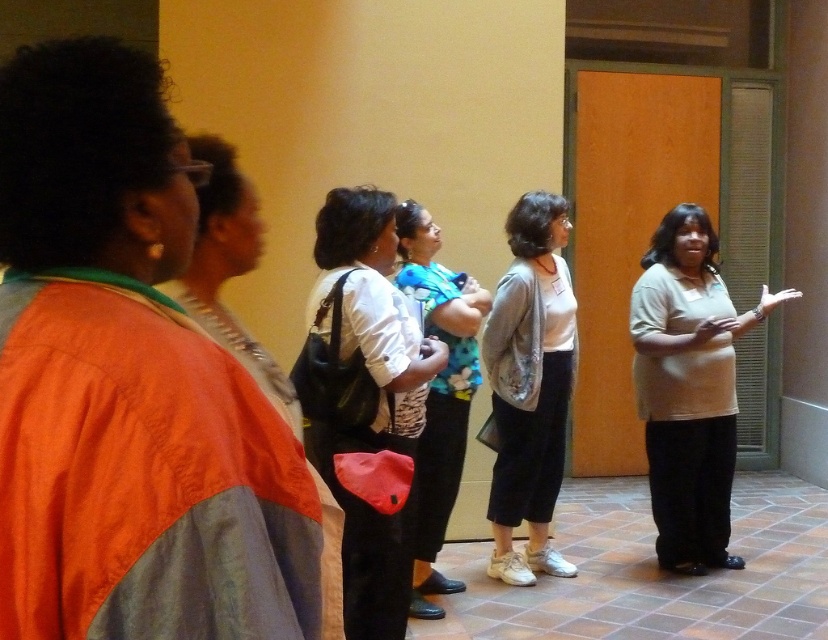
Question: Does white fabric shirt at center have a larger size compared to floral fabric blouse at center?

Choices:
 (A) no
 (B) yes

Answer: (B)

Question: Which point is farther to the camera?

Choices:
 (A) beige matte shirt at center
 (B) white fabric shirt at center
 (C) gray sweater at center

Answer: (C)

Question: Among these points, which one is farthest from the camera?

Choices:
 (A) (294, 420)
 (B) (559, 326)
 (C) (359, 524)
 (D) (658, 461)

Answer: (D)

Question: Which point is farther to the camera?

Choices:
 (A) (557, 304)
 (B) (362, 237)
 (C) (431, 572)
 (D) (699, 275)

Answer: (D)

Question: Does floral fabric blouse at center appear over matte orange jacket at left?

Choices:
 (A) yes
 (B) no

Answer: (B)

Question: Is beige matte shirt at center behind matte orange jacket at left?

Choices:
 (A) yes
 (B) no

Answer: (A)